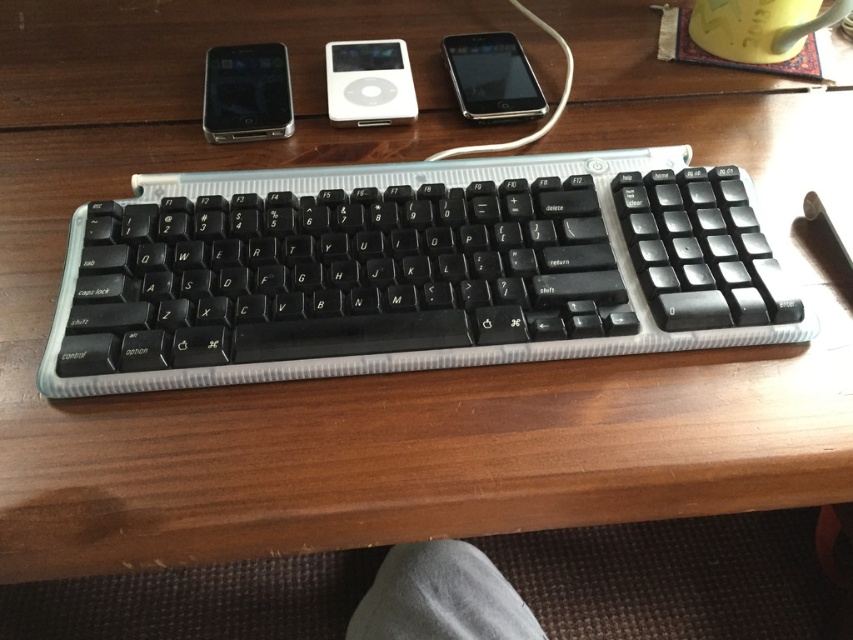
You are organizing the desk and want to move the white glossy ipod at center and the sleek black smartphone at center closer to the edge. Which device should you move first to make space without disturbing the other?

You should move the white glossy ipod at center first because it is in front of the sleek black smartphone at center, so moving it first will allow you to create space without disturbing the smartphone.

You are a person with a 22 inch arm length. You want to reach the matte black smartphone at upper left from where you are sitting. Can you reach it without moving your chair?

The matte black smartphone at upper left and camera are 23.17 inches apart. Since your arm is only 22 inches long, you cannot reach the matte black smartphone at upper left without moving your chair.

You are trying to reach the point at coordinates point (561,260) on the desk. Your hand is currently 20 inches away from the desk surface. Can you touch the point without moving your hand closer?

The point (561,260) is 19.31 inches from the viewer. Since your hand is 20 inches away, which is farther than the point, you cannot touch it without moving your hand closer.